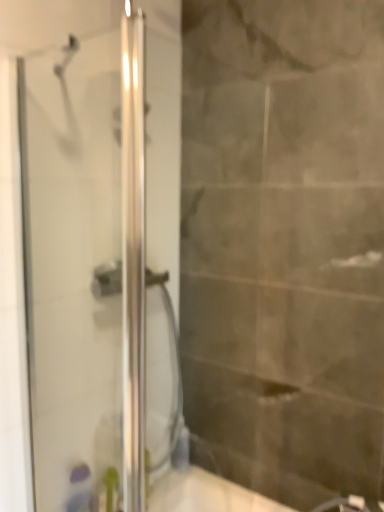
Find the location of a particular element. transparent glass shower door at left is located at coordinates pos(72,258).

What is the approximate height of transparent glass shower door at left?

It is 4.15 feet.

What do you see at coordinates (72, 258) in the screenshot? The height and width of the screenshot is (512, 384). I see `transparent glass shower door at left` at bounding box center [72, 258].

In order to click on transparent glass shower door at left in this screenshot , I will do 72,258.